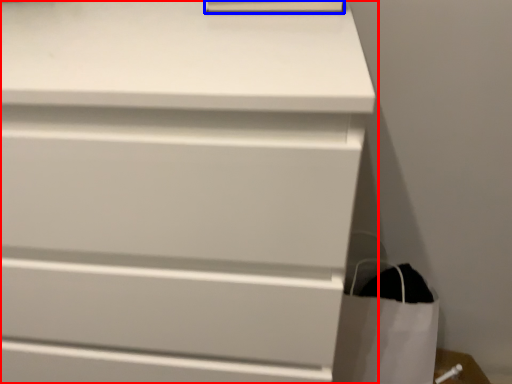
Question: Among these objects, which one is nearest to the camera, chest of drawers (highlighted by a red box) or paperback book (highlighted by a blue box)?

Choices:
 (A) chest of drawers
 (B) paperback book

Answer: (A)